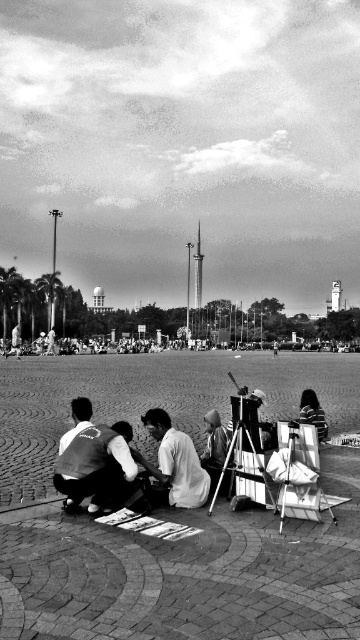
Which is behind, point (213, 429) or point (322, 410)?

Point (322, 410)

Who is more distant from viewer, (218, 472) or (322, 438)?

Positioned behind is point (322, 438).

I want to click on smooth black shirt at center, so click(x=213, y=445).

Between point (92, 376) and point (64, 454), which one is positioned behind?

The point (92, 376) is more distant.

Can you confirm if metallic tripod at center is bigger than white cotton shirt at center?

Yes, metallic tripod at center is bigger than white cotton shirt at center.

Where is `metallic tripod at center`? metallic tripod at center is located at coordinates (172, 509).

Does white cotton shirt at center have a smaller size compared to striped shirt at center?

No, white cotton shirt at center is not smaller than striped shirt at center.

Is white cotton shirt at center shorter than striped shirt at center?

In fact, white cotton shirt at center may be taller than striped shirt at center.

Measure the distance between white cotton shirt at center and camera.

white cotton shirt at center is 16.53 meters from camera.

The height and width of the screenshot is (640, 360). I want to click on white cotton shirt at center, so click(92, 461).